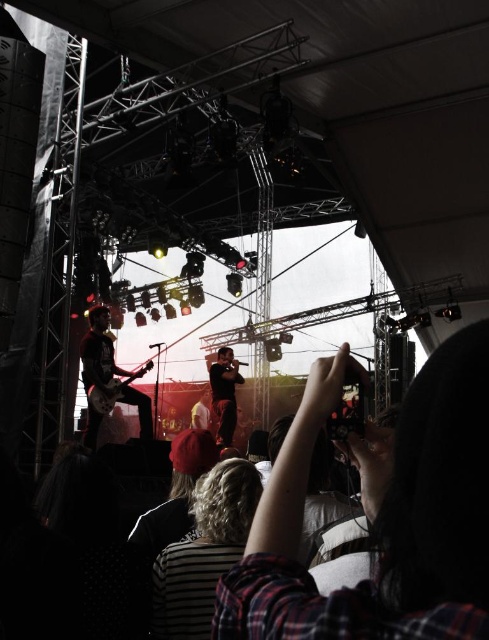
Question: Which of the following is the closest to the observer?

Choices:
 (A) dark hair at center
 (B) shiny black guitar at left
 (C) striped fabric shirt at center

Answer: (A)

Question: Does dark hair at center have a greater width compared to shiny black guitar at left?

Choices:
 (A) yes
 (B) no

Answer: (B)

Question: Which is farther from the black matte microphone at center?

Choices:
 (A) striped fabric shirt at center
 (B) plaid fabric shirt at center
 (C) dark hair at center

Answer: (B)

Question: Is black matte microphone at center further to camera compared to matte black guitar at left?

Choices:
 (A) yes
 (B) no

Answer: (A)

Question: Based on their relative distances, which object is farther from the shiny black guitar at left?

Choices:
 (A) striped fabric shirt at center
 (B) black matte microphone at center
 (C) dark hair at center
 (D) matte black guitar at left

Answer: (A)

Question: Is plaid fabric shirt at center thinner than black matte microphone at center?

Choices:
 (A) no
 (B) yes

Answer: (A)